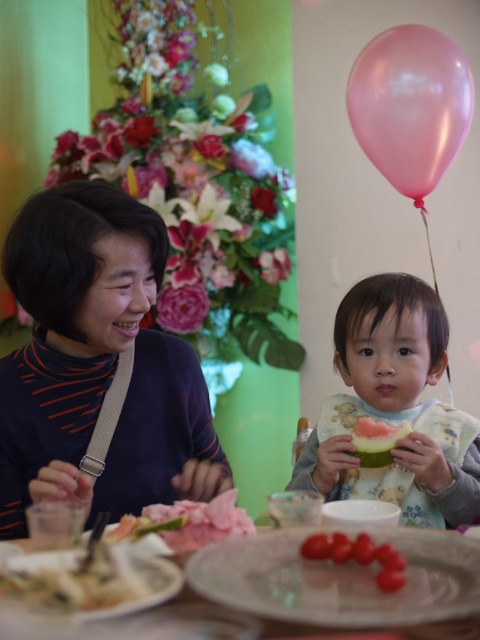
Question: Among these points, which one is nearest to the camera?

Choices:
 (A) (431, 86)
 (B) (427, 310)
 (C) (380, 552)

Answer: (C)

Question: Considering the real-world distances, which object is farthest from the white glossy plate at lower center?

Choices:
 (A) green matte watermelon at lower right
 (B) smooth green bib at lower right
 (C) smooth red cherry tomatoes at center
 (D) pink glossy balloon at upper right

Answer: (D)

Question: Is smooth green bib at lower right above green matte watermelon at lower right?

Choices:
 (A) yes
 (B) no

Answer: (A)

Question: Considering the real-world distances, which object is closest to the pink glossy balloon at upper right?

Choices:
 (A) smooth red cherry tomatoes at center
 (B) smooth green bib at lower right

Answer: (B)

Question: Can you confirm if pink glossy balloon at upper right is bigger than smooth red cherry tomatoes at center?

Choices:
 (A) no
 (B) yes

Answer: (B)

Question: Is white glossy plate at lower center thinner than green matte watermelon at lower right?

Choices:
 (A) yes
 (B) no

Answer: (B)